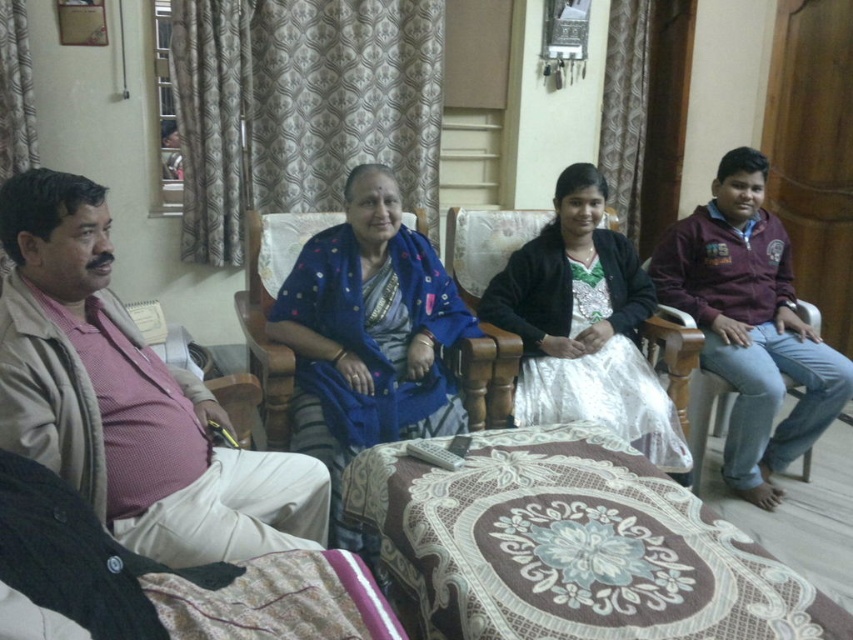
You are a furniture designer evaluating seating arrangements. The beige cotton pants at left and the matte brown wood armchair at right are part of a living room setup. Which object has a greater width?

The beige cotton pants at left has a greater width than the matte brown wood armchair at right according to the description.

You are standing in the living room and see the point at coordinates (126, 400). Which object is this point located on?

The point at coordinates (126, 400) is located on the pink woven shirt at left.